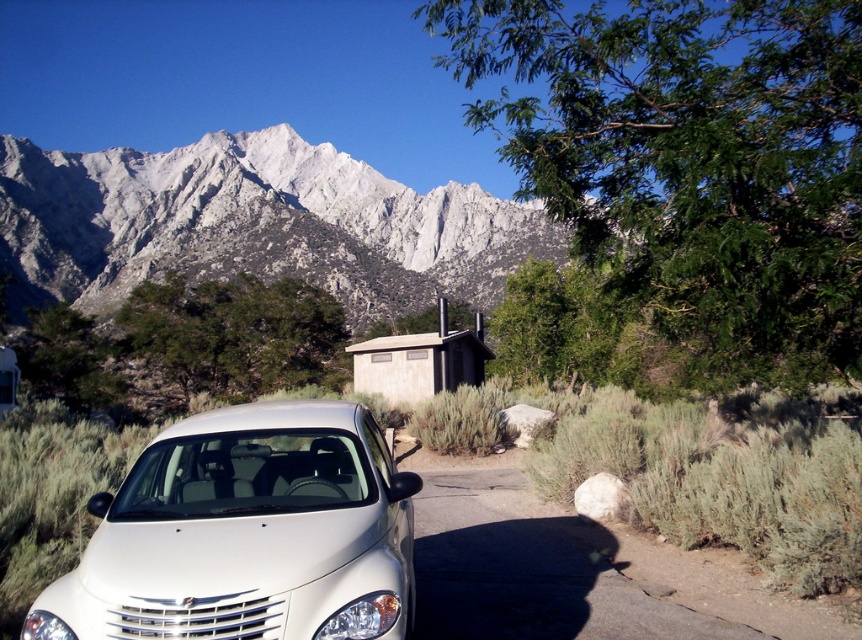
You are standing at the parking lot and want to take a photo of the snowy granite mountain range at upper left. Which direction should you face to capture the mountain range in your camera view?

The snowy granite mountain range at upper left is located at point (254, 225), so you should face the upper left direction to capture it in your camera view.

You are a hiker who wants to take a photo of the white glossy car at lower left and the beige wood cabin at center from a distance. What is the minimum distance you need to walk to capture both in one frame?

The minimum distance you need to walk is 20.64 meters to ensure both the white glossy car at lower left and the beige wood cabin at center are within the frame, as they are 20.64 meters apart from each other.

You are a hiker planning to take a photo of the snowy granite mountain range at upper left and the beige wood cabin at center from a position near the white car. Which object will appear higher in your photo?

The snowy granite mountain range at upper left will appear higher in the photo because it is positioned above the beige wood cabin at center.